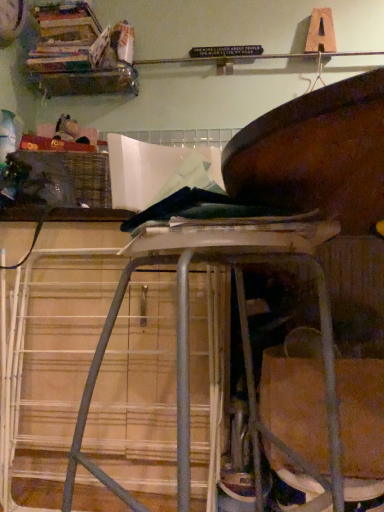
Question: Considering the relative sizes of woven plastic crate at left and metal stool at center in the image provided, is woven plastic crate at left thinner than metal stool at center?

Choices:
 (A) yes
 (B) no

Answer: (A)

Question: Is woven plastic crate at left next to metal stool at center and touching it?

Choices:
 (A) no
 (B) yes

Answer: (A)

Question: From the image's perspective, does woven plastic crate at left appear lower than metal stool at center?

Choices:
 (A) no
 (B) yes

Answer: (A)

Question: Can you confirm if woven plastic crate at left is positioned to the left of metal stool at center?

Choices:
 (A) no
 (B) yes

Answer: (B)

Question: Is woven plastic crate at left completely or partially outside of metal stool at center?

Choices:
 (A) no
 (B) yes

Answer: (B)

Question: From the image's perspective, is wooden books at upper left located above or below woven plastic crate at left?

Choices:
 (A) above
 (B) below

Answer: (A)

Question: Relative to woven plastic crate at left, is wooden books at upper left in front or behind?

Choices:
 (A) behind
 (B) front

Answer: (A)

Question: From a real-world perspective, is wooden books at upper left positioned above or below woven plastic crate at left?

Choices:
 (A) below
 (B) above

Answer: (B)

Question: Is wooden books at upper left taller or shorter than woven plastic crate at left?

Choices:
 (A) short
 (B) tall

Answer: (B)

Question: Considering the positions of wooden books at upper left and metal stool at center in the image, is wooden books at upper left taller or shorter than metal stool at center?

Choices:
 (A) short
 (B) tall

Answer: (A)

Question: Considering the positions of wooden books at upper left and metal stool at center in the image, is wooden books at upper left bigger or smaller than metal stool at center?

Choices:
 (A) small
 (B) big

Answer: (A)

Question: Based on their positions, is wooden books at upper left located to the left or right of metal stool at center?

Choices:
 (A) left
 (B) right

Answer: (A)

Question: Considering the positions of wooden books at upper left and metal stool at center in the image, is wooden books at upper left wider or thinner than metal stool at center?

Choices:
 (A) wide
 (B) thin

Answer: (B)

Question: From a real-world perspective, is woven plastic crate at left physically located above or below metal stool at center?

Choices:
 (A) above
 (B) below

Answer: (A)

Question: Is woven plastic crate at left wider or thinner than metal stool at center?

Choices:
 (A) wide
 (B) thin

Answer: (B)